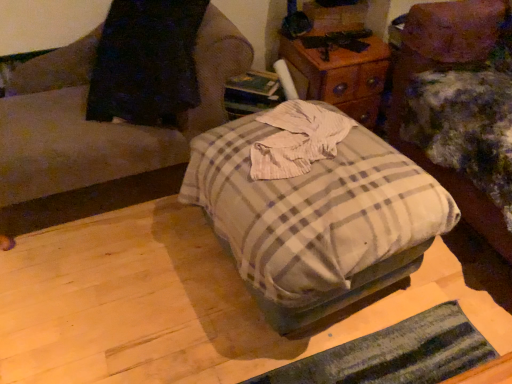
This screenshot has width=512, height=384. What are the coordinates of `vacant space that's between plaid fabric ottoman at center, the second furniture when ordered from right to left, and plaid fabric ottoman at center` in the screenshot? It's located at (144, 285).